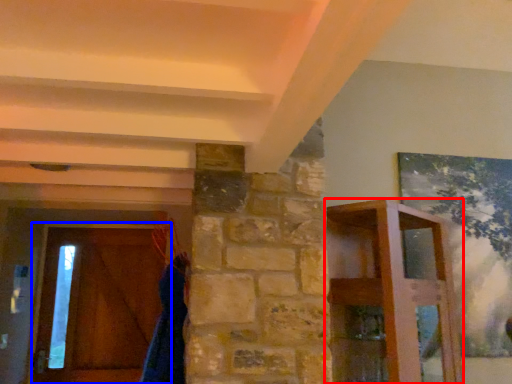
Question: Which object is further to the camera taking this photo, furniture (highlighted by a red box) or barn door (highlighted by a blue box)?

Choices:
 (A) furniture
 (B) barn door

Answer: (B)